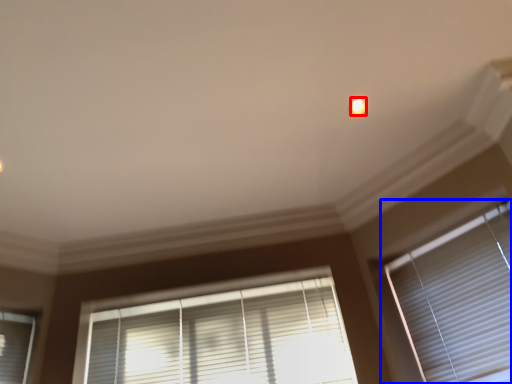
Question: Which of the following is the closest to the observer, light (highlighted by a red box) or window blind (highlighted by a blue box)?

Choices:
 (A) light
 (B) window blind

Answer: (B)